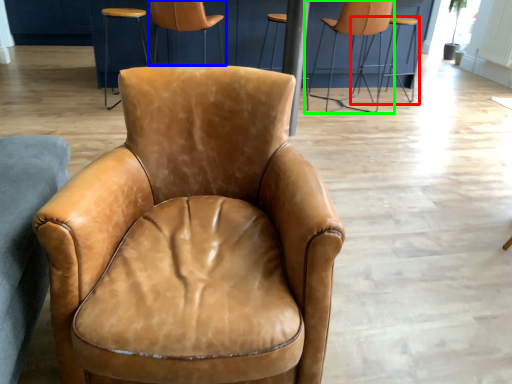
Question: Estimate the real-world distances between objects in this image. Which object is farther from chair (highlighted by a red box), chair (highlighted by a blue box) or chair (highlighted by a green box)?

Choices:
 (A) chair
 (B) chair

Answer: (A)